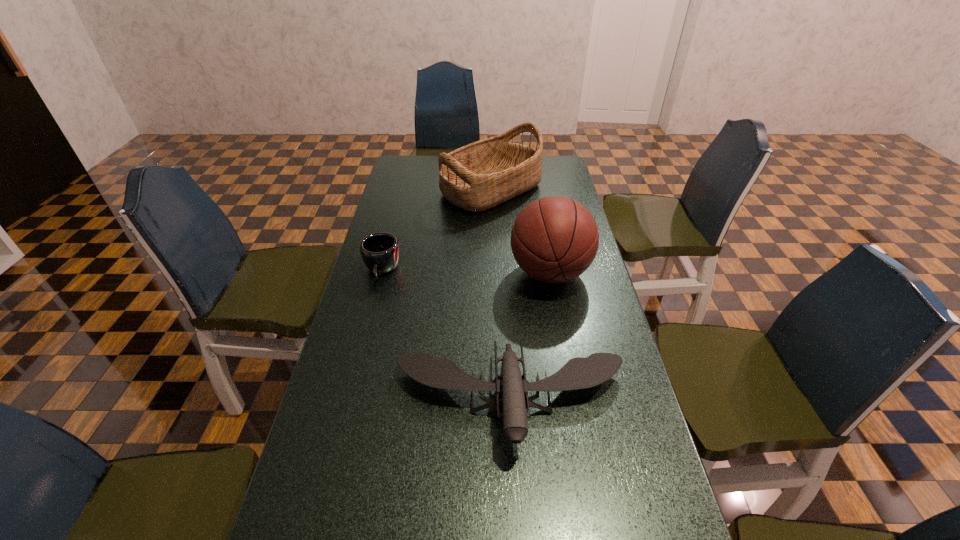
The width and height of the screenshot is (960, 540). Find the location of `object that is at the left edge`. object that is at the left edge is located at coordinates (380, 251).

Find the location of a particular element. The image size is (960, 540). basketball that is at the right edge is located at coordinates [x=554, y=239].

Where is `basket that is at the right edge`? The image size is (960, 540). basket that is at the right edge is located at coordinates (481, 175).

Where is `drone that is at the right edge`? The width and height of the screenshot is (960, 540). drone that is at the right edge is located at coordinates (578, 373).

Image resolution: width=960 pixels, height=540 pixels. In order to click on object positioned at the far right corner in this screenshot , I will do `click(481, 175)`.

This screenshot has width=960, height=540. In the image, there is a desktop. What are the coordinates of `vacant space at the left edge` in the screenshot? It's located at (355, 390).

Locate an element on the screen. This screenshot has width=960, height=540. vacant space at the right edge of the desktop is located at coordinates (558, 184).

Locate an element on the screen. The image size is (960, 540). vacant space at the far left corner of the desktop is located at coordinates (409, 167).

At what (x,y) coordinates should I click in order to perform the action: click on vacant area between the drone and the third shortest object. Please return your answer as a coordinate pair (x, y). Looking at the image, I should click on (501, 294).

Where is `vacant region between the leftmost object and the third shortest object`? Image resolution: width=960 pixels, height=540 pixels. vacant region between the leftmost object and the third shortest object is located at coordinates (437, 230).